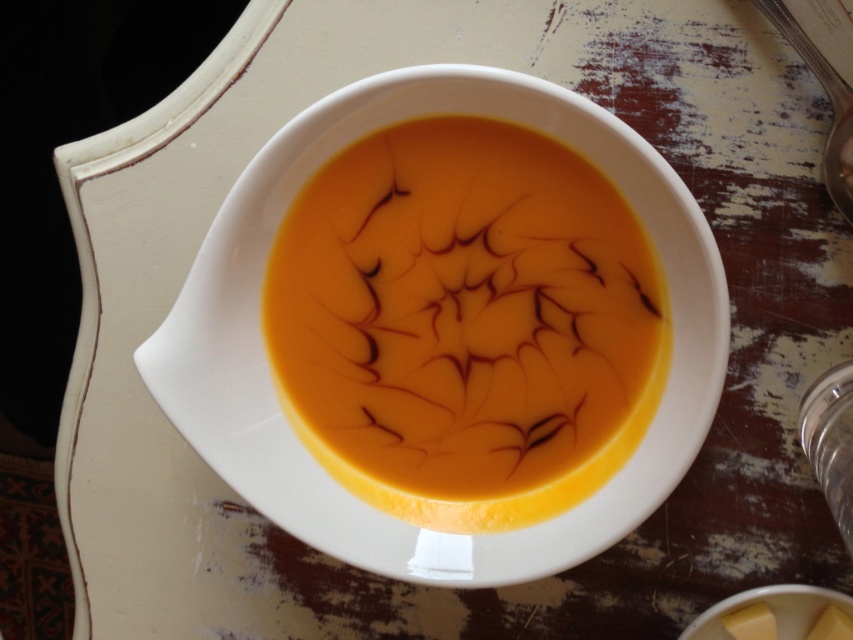
Question: Is orange smoothie at center positioned at the back of metallic silver spoon at upper right?

Choices:
 (A) no
 (B) yes

Answer: (A)

Question: Is orange smoothie at center bigger than metallic silver spoon at upper right?

Choices:
 (A) no
 (B) yes

Answer: (B)

Question: Does orange smoothie at center have a greater width compared to metallic silver spoon at upper right?

Choices:
 (A) yes
 (B) no

Answer: (A)

Question: Which point is farther to the camera?

Choices:
 (A) metallic silver spoon at upper right
 (B) orange smoothie at center

Answer: (A)

Question: Which of the following is the closest to the observer?

Choices:
 (A) orange smoothie at center
 (B) metallic silver spoon at upper right

Answer: (A)